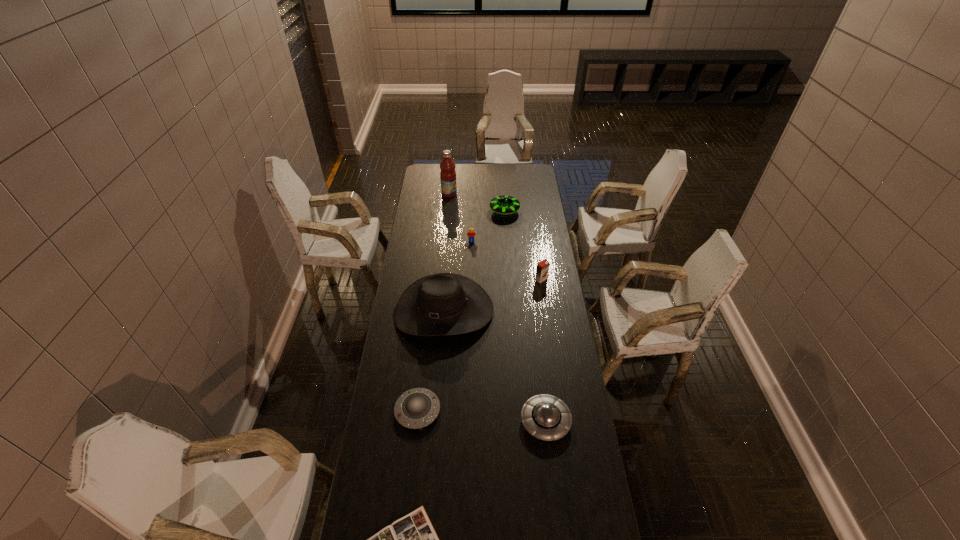
The width and height of the screenshot is (960, 540). Find the location of `free location located 0.190m on the back of the sixth shortest object`. free location located 0.190m on the back of the sixth shortest object is located at coordinates (537, 249).

This screenshot has width=960, height=540. I want to click on free point located 0.280m on the left of the farthest saucer, so click(x=440, y=211).

Locate an element on the screen. The width and height of the screenshot is (960, 540). free space located 0.140m on the face of the third farthest object is located at coordinates (471, 260).

Where is `vacant space located 0.350m on the right of the leftmost saucer`? The height and width of the screenshot is (540, 960). vacant space located 0.350m on the right of the leftmost saucer is located at coordinates (537, 410).

The image size is (960, 540). Find the location of `fruit juice at the left edge`. fruit juice at the left edge is located at coordinates (448, 174).

I want to click on cowboy hat that is at the left edge, so click(443, 304).

You are a GUI agent. You are given a task and a screenshot of the screen. Output one action in this format:
    pyautogui.click(x=<x>, y=<y>)
    Task: Click on the saucer at the left edge
    This screenshot has width=960, height=540.
    Given the screenshot: What is the action you would take?
    pyautogui.click(x=416, y=408)

What are the coordinates of `orange juice at the right edge` in the screenshot? It's located at (542, 269).

Where is `free region at the far edge of the desktop`? free region at the far edge of the desktop is located at coordinates (468, 164).

In the image, there is a desktop. Find the location of `free space at the left edge`. free space at the left edge is located at coordinates (421, 227).